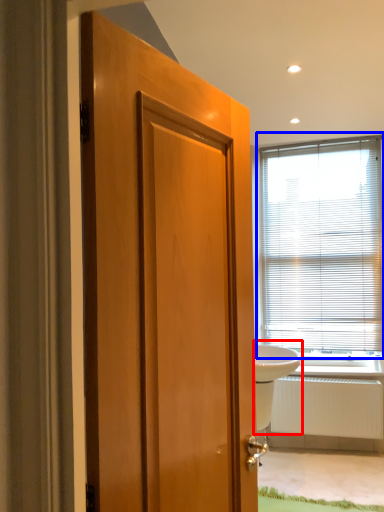
Question: Which point is further to the camera, sink (highlighted by a red box) or window blind (highlighted by a blue box)?

Choices:
 (A) sink
 (B) window blind

Answer: (B)